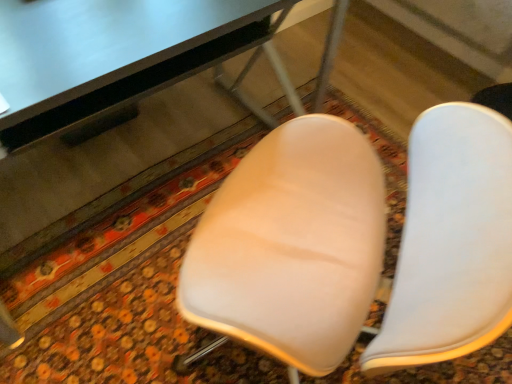
Question: Is matte black table at upper center taller or shorter than white matte chair at center?

Choices:
 (A) short
 (B) tall

Answer: (B)

Question: Is point (41, 117) positioned closer to the camera than point (451, 122)?

Choices:
 (A) farther
 (B) closer

Answer: (A)

Question: In the image, is matte black table at upper center positioned in front of or behind white matte chair at center?

Choices:
 (A) front
 (B) behind

Answer: (A)

Question: Relative to matte black table at upper center, is white matte chair at center in front or behind?

Choices:
 (A) front
 (B) behind

Answer: (B)

Question: Which is correct: white matte chair at center is inside matte black table at upper center, or outside of it?

Choices:
 (A) inside
 (B) outside

Answer: (B)

Question: From the image's perspective, is white matte chair at center positioned above or below matte black table at upper center?

Choices:
 (A) above
 (B) below

Answer: (B)

Question: Considering the positions of white matte chair at center and matte black table at upper center in the image, is white matte chair at center wider or thinner than matte black table at upper center?

Choices:
 (A) wide
 (B) thin

Answer: (A)